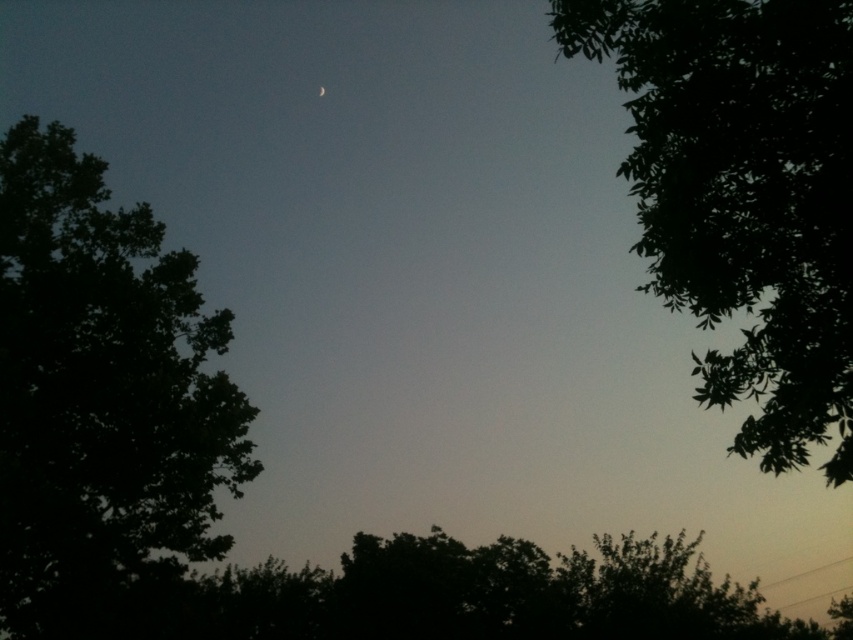
Between point (67, 595) and point (318, 84), which one is positioned behind?

Positioned behind is point (318, 84).

Is point (62, 593) closer to viewer compared to point (320, 90)?

Yes, point (62, 593) is in front of point (320, 90).

Where is `dark green leafy tree at left`? dark green leafy tree at left is located at coordinates (102, 388).

Who is lower down, green leafy tree at upper right or silver metallic moon at upper center?

green leafy tree at upper right

Which is in front, point (792, 65) or point (320, 90)?

Point (792, 65)

Identify the location of green leafy tree at upper right. (744, 195).

Is dark green leafy tree at left thinner than green leafy tree at upper right?

No.

Which is in front, point (157, 241) or point (781, 337)?

Point (781, 337) is in front.

I want to click on dark green leafy tree at left, so click(x=102, y=388).